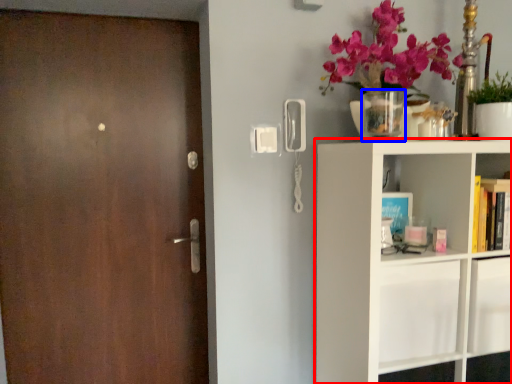
Question: Which object appears farthest to the camera in this image, shelf (highlighted by a red box) or vase (highlighted by a blue box)?

Choices:
 (A) shelf
 (B) vase

Answer: (B)